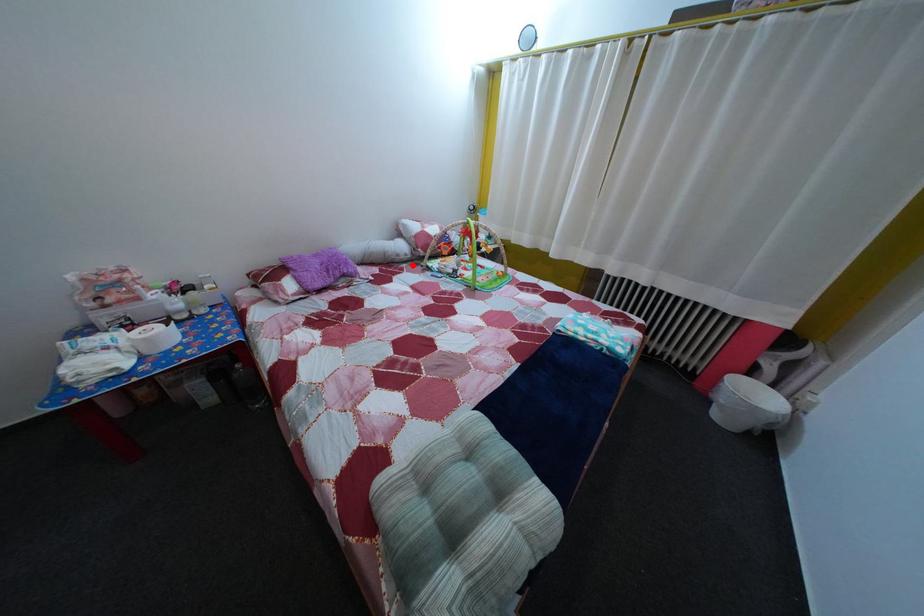
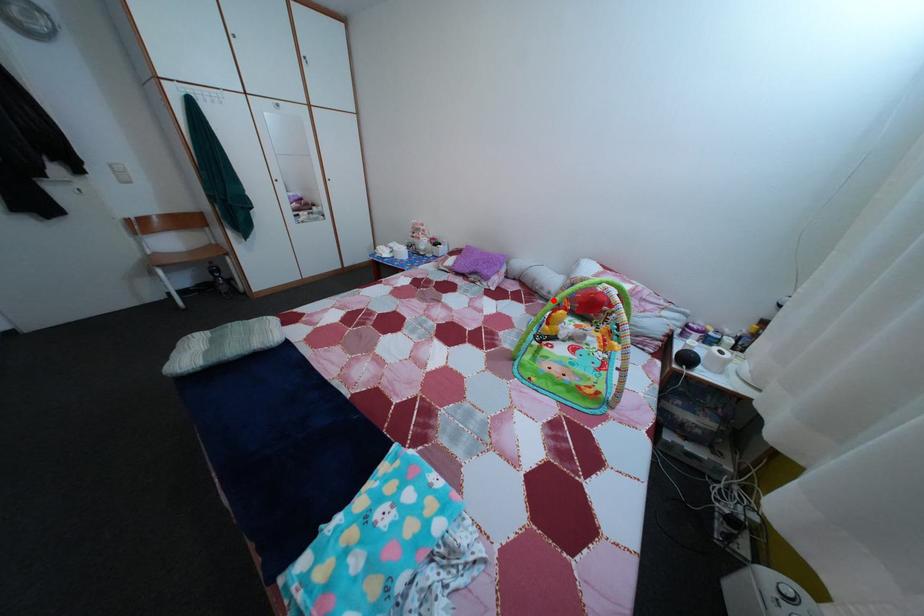
I am providing you with two images of the same scene from different viewpoints. A red point is marked on the first image and another point is marked on the second image. Do the highlighted points in image1 and image2 indicate the same real-world spot?

Yes